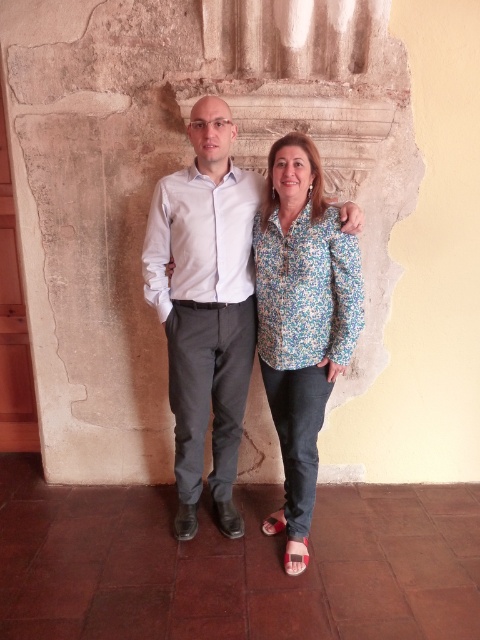
You are a tailor measuring fabrics for alterations. You have a piece of fabric that is exactly the same width as the pink fabric sandal at lower center. Can you use this fabric to make a new floral print blouse at center without needing to cut the fabric? Explain your reasoning.

The floral print blouse at center has a larger width than the pink fabric sandal at lower center. Since the fabric provided matches the sandal width, it would be insufficient to cover the blouse width. Additional fabric or adjustments would be necessary.